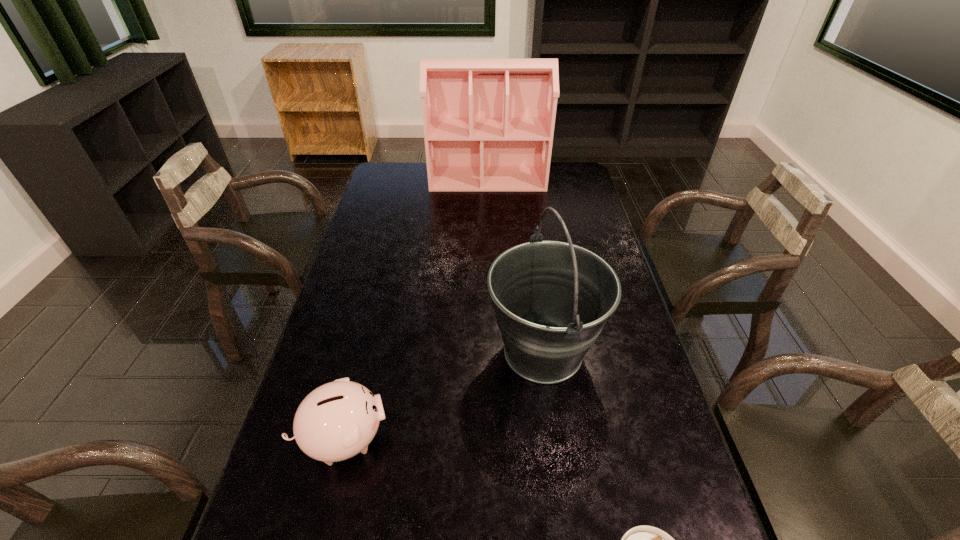
In order to click on the farthest object in this screenshot , I will do pos(488,124).

The image size is (960, 540). Identify the location of bucket. (552, 299).

Identify the location of the third tallest object. (336, 421).

Image resolution: width=960 pixels, height=540 pixels. I want to click on vacant region located 0.380m on the front-facing side of the farthest object, so click(x=490, y=250).

Where is `free space located on the back of the bucket`? The height and width of the screenshot is (540, 960). free space located on the back of the bucket is located at coordinates (535, 288).

Where is `vacant space situated on the back of the second shortest object`? The width and height of the screenshot is (960, 540). vacant space situated on the back of the second shortest object is located at coordinates (357, 385).

Locate an element on the screen. object that is positioned at the far edge is located at coordinates (488, 124).

Locate an element on the screen. The width and height of the screenshot is (960, 540). object present at the left edge is located at coordinates (336, 421).

Where is `object situated at the right edge`? The width and height of the screenshot is (960, 540). object situated at the right edge is located at coordinates (552, 299).

Identify the location of vacant region at the left edge of the desktop. (323, 362).